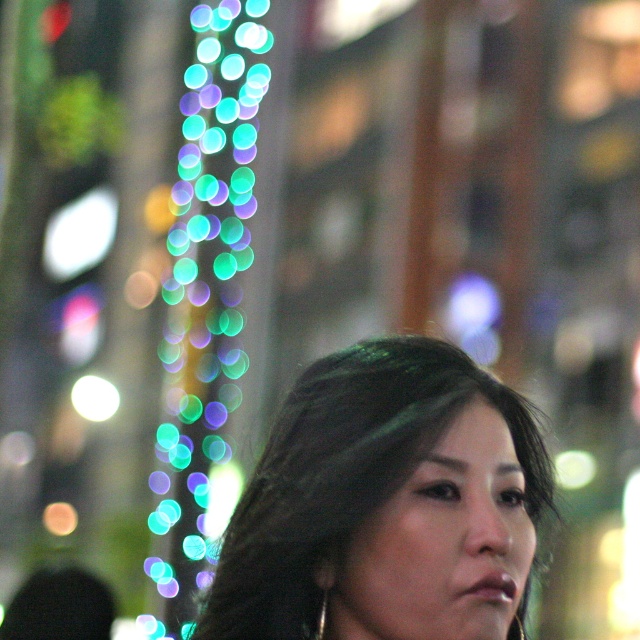
Question: Which point is farther to the camera?

Choices:
 (A) (193, 193)
 (B) (416, 401)

Answer: (A)

Question: Is smooth dark hair at center to the right of multicolored glass beads at left from the viewer's perspective?

Choices:
 (A) yes
 (B) no

Answer: (A)

Question: Which of the following is the farthest from the observer?

Choices:
 (A) (177, 332)
 (B) (467, 358)

Answer: (A)

Question: Does smooth dark hair at center have a smaller size compared to multicolored glass beads at left?

Choices:
 (A) no
 (B) yes

Answer: (B)

Question: Among these points, which one is farthest from the camera?

Choices:
 (A) (189, 506)
 (B) (403, 444)

Answer: (A)

Question: Can you confirm if smooth dark hair at center is bigger than multicolored glass beads at left?

Choices:
 (A) yes
 (B) no

Answer: (B)